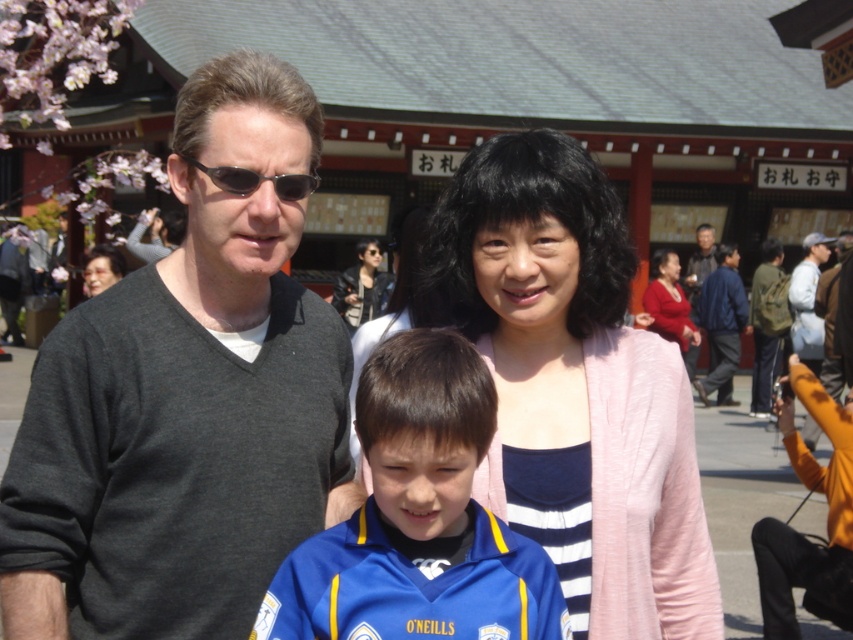
Which is behind, point (808, 332) or point (367, 305)?

Point (367, 305)

Which is more to the right, light gray jacket at right or matte black jacket at center?

light gray jacket at right is more to the right.

Identify the location of light gray jacket at right. (809, 304).

Locate an element on the screen. light gray jacket at right is located at coordinates (809, 304).

Is pink fabric at center to the right of blue jersey at center from the viewer's perspective?

Correct, you'll find pink fabric at center to the right of blue jersey at center.

Does pink fabric at center have a lesser height compared to blue jersey at center?

No, pink fabric at center is not shorter than blue jersey at center.

Image resolution: width=853 pixels, height=640 pixels. In order to click on pink fabric at center in this screenshot , I will do `click(573, 387)`.

The height and width of the screenshot is (640, 853). What are the coordinates of `pink fabric at center` in the screenshot? It's located at (573, 387).

Which of these two, pink fabric at center or matte black jacket at center, stands taller?

pink fabric at center

Is point (592, 180) positioned in front of point (376, 266)?

Yes, it is.

I want to click on pink fabric at center, so click(x=573, y=387).